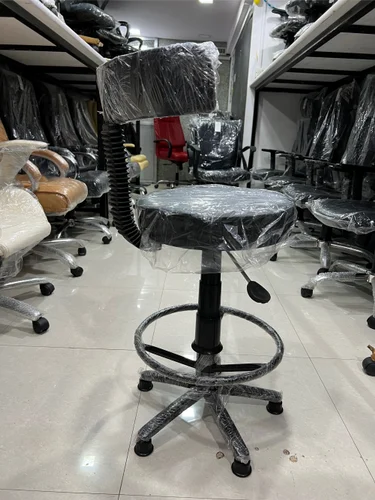
Image resolution: width=375 pixels, height=500 pixels. In order to click on floor in this screenshot , I will do [325, 429].